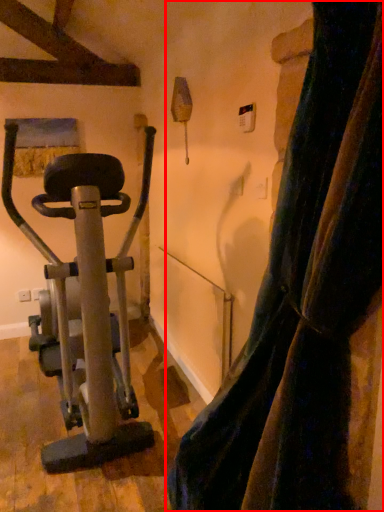
Question: From the image's perspective, where is curtain (annotated by the red box) located relative to stationary bicycle?

Choices:
 (A) below
 (B) above

Answer: (A)